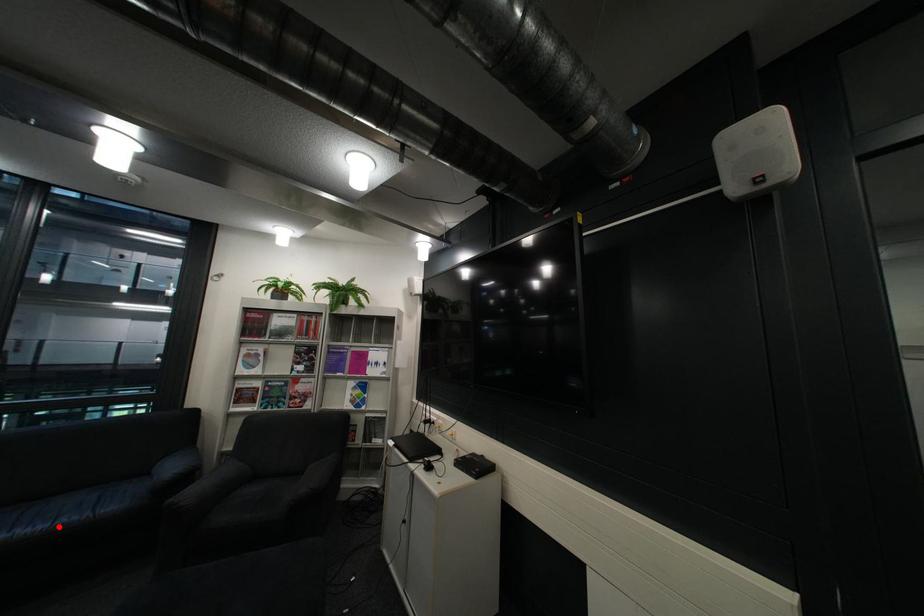
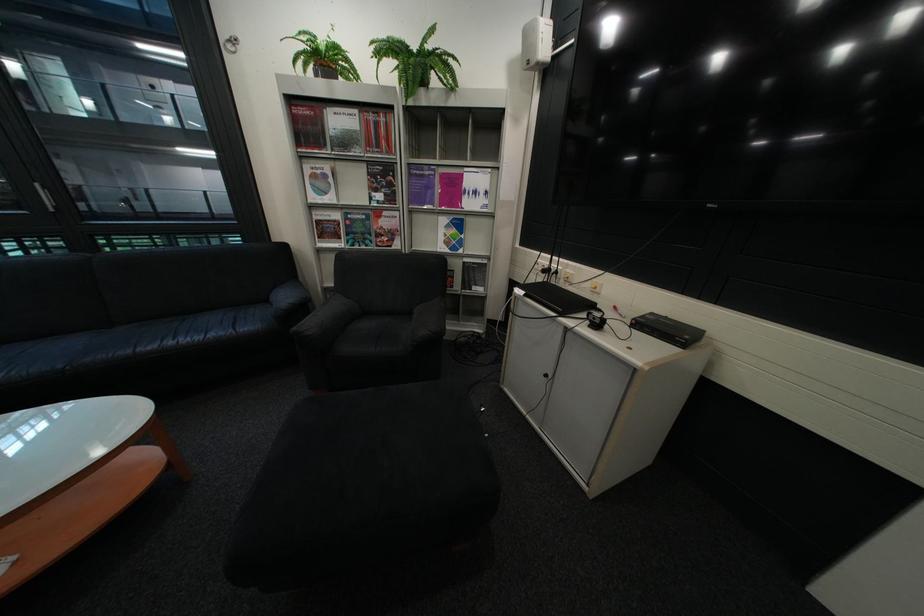
Locate, in the second image, the point that corresponds to the highlighted location in the first image.

(213, 338)